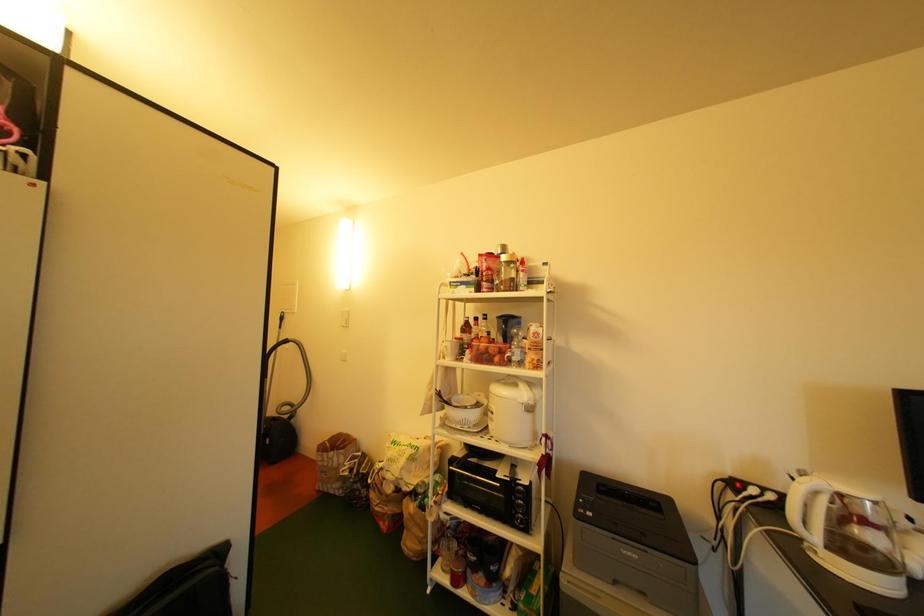
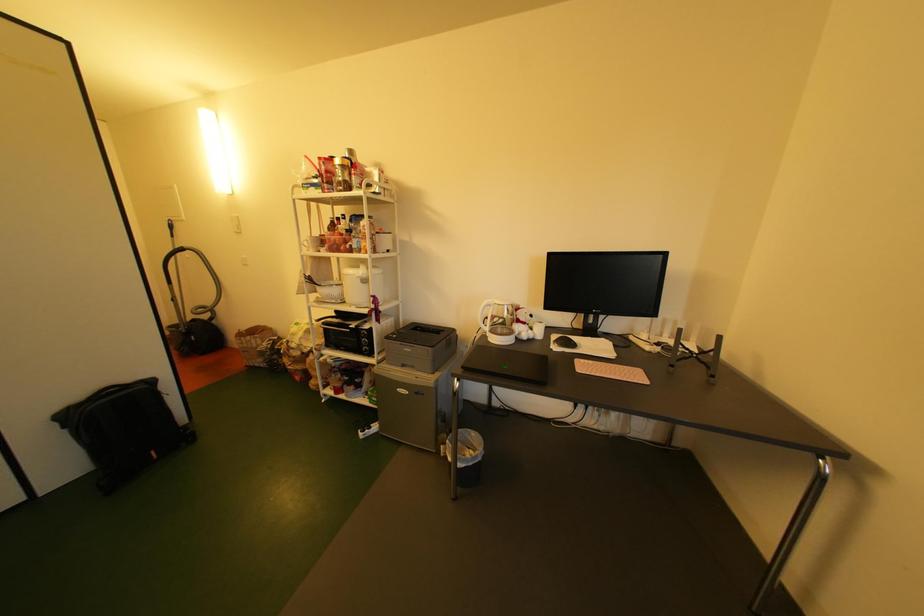
What movement of the cameraman would produce the second image?

The movement direction of the cameraman is right, backward.